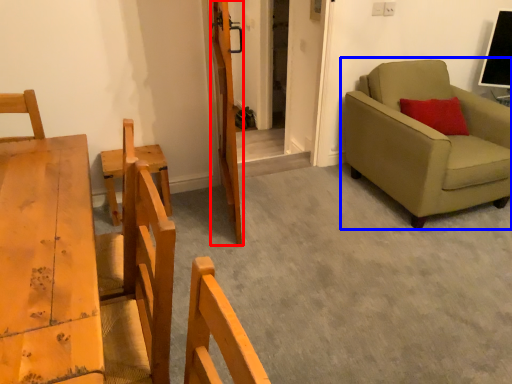
Question: Which of the following is the farthest to the observer, door (highlighted by a red box) or studio couch (highlighted by a blue box)?

Choices:
 (A) door
 (B) studio couch

Answer: (B)